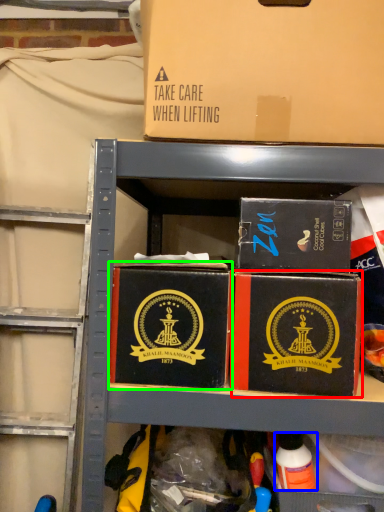
Question: Based on their relative distances, which object is nearer to box (highlighted by a red box)? Choose from toy (highlighted by a blue box) and box (highlighted by a green box).

Choices:
 (A) toy
 (B) box

Answer: (B)